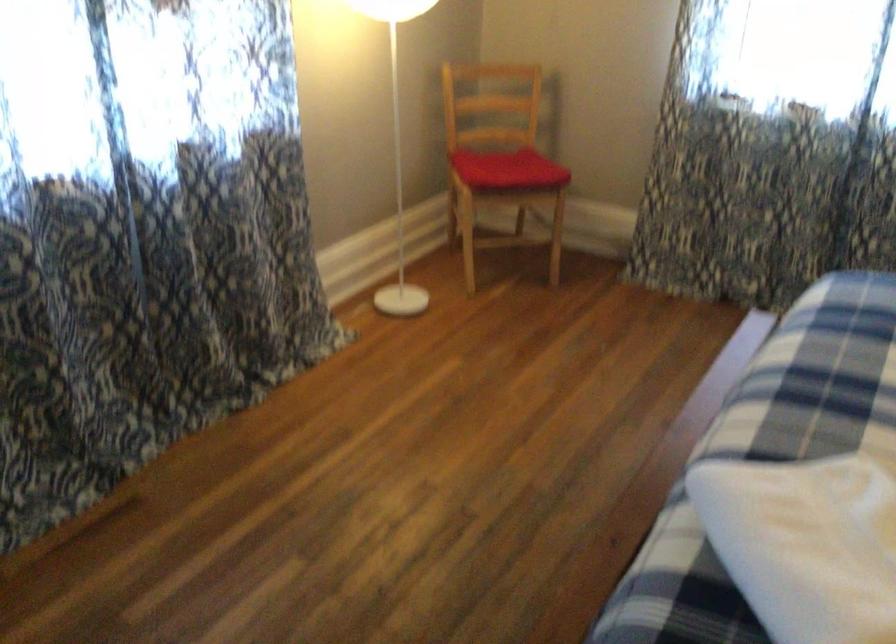
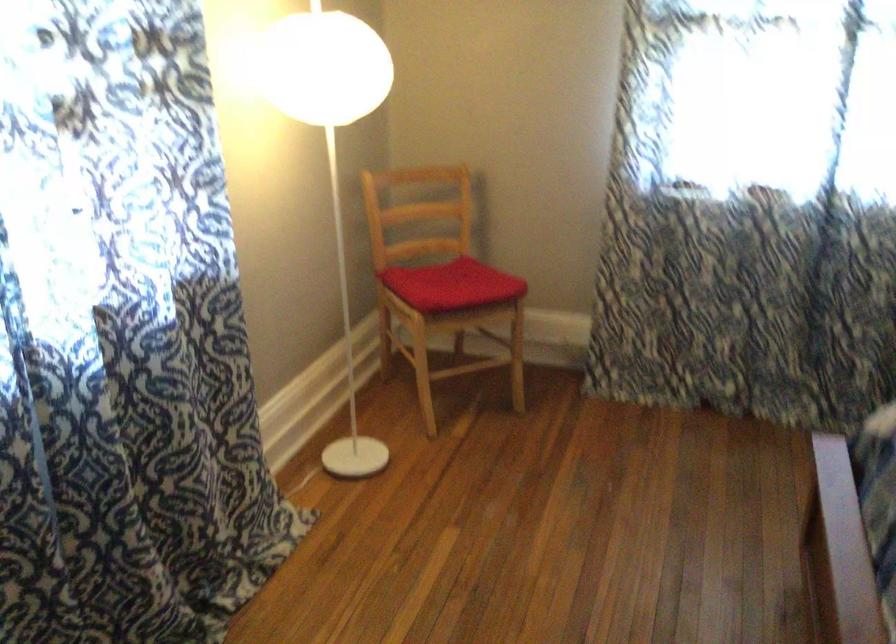
Question: The camera is either moving clockwise (left) or counter-clockwise (right) around the object. The first image is from the beginning of the video and the second image is from the end. Is the camera moving left or right when shooting the video?

Choices:
 (A) Left
 (B) Right

Answer: (A)